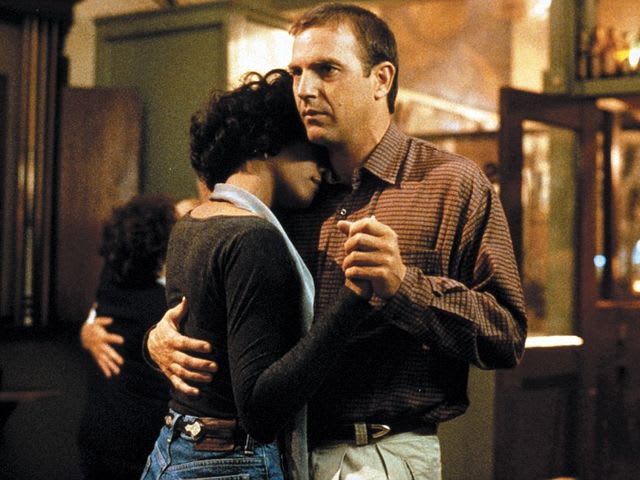
The image size is (640, 480). In order to click on door in this screenshot , I will do click(547, 369).